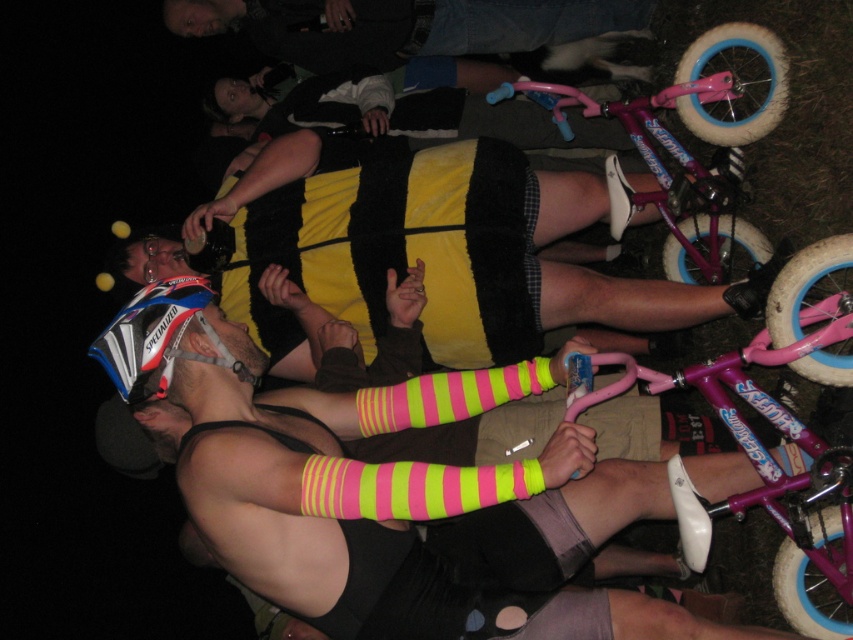
The image size is (853, 640). Describe the element at coordinates (440, 252) in the screenshot. I see `yellow/black fuzzy shorts at center` at that location.

Can you confirm if yellow/black fuzzy shorts at center is shorter than denim pants at upper center?

Incorrect, yellow/black fuzzy shorts at center's height does not fall short of denim pants at upper center's.

Measure the distance between point (x=387, y=154) and camera.

Point (x=387, y=154) and camera are 3.10 meters apart.

This screenshot has height=640, width=853. Identify the location of yellow/black fuzzy shorts at center. [x=440, y=252].

Who is lower down, denim pants at upper center or matte black helmet at left?

matte black helmet at left is below.

Can you confirm if denim pants at upper center is shorter than matte black helmet at left?

No, denim pants at upper center is not shorter than matte black helmet at left.

Between point (408, 22) and point (164, 310), which one is positioned behind?

Positioned behind is point (408, 22).

Locate an element on the screen. denim pants at upper center is located at coordinates (401, 26).

Is yellow/black fuzzy shorts at center thinner than matte black helmet at left?

No, yellow/black fuzzy shorts at center is not thinner than matte black helmet at left.

Consider the image. Does yellow/black fuzzy shorts at center come in front of matte black helmet at left?

No, it is not.

This screenshot has height=640, width=853. What do you see at coordinates (440, 252) in the screenshot?
I see `yellow/black fuzzy shorts at center` at bounding box center [440, 252].

Image resolution: width=853 pixels, height=640 pixels. I want to click on yellow/black fuzzy shorts at center, so click(440, 252).